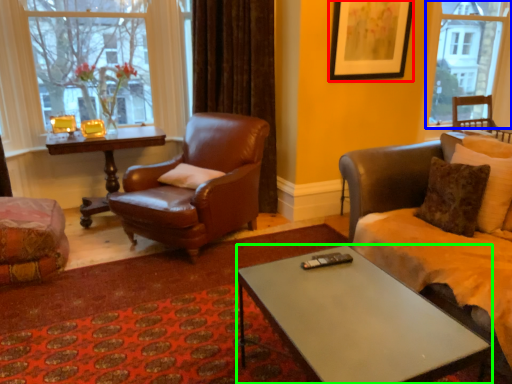
Question: Which is nearer to the picture frame (highlighted by a red box)? window (highlighted by a blue box) or coffee table (highlighted by a green box).

Choices:
 (A) window
 (B) coffee table

Answer: (A)